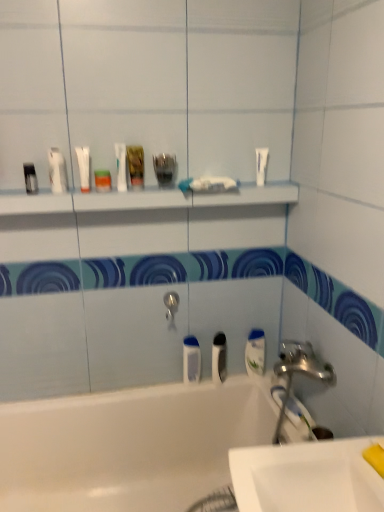
Locate an element on the screen. white glossy mouthwash at right, placed as the fifth mouthwash when sorted from left to right is located at coordinates (255, 352).

Where is `metallic silver container at center, the third toiletry from the left`? metallic silver container at center, the third toiletry from the left is located at coordinates (164, 168).

What do you see at coordinates (298, 415) in the screenshot?
I see `white plastic toothbrush at lower right` at bounding box center [298, 415].

Find the location of a particular element. matte black container at upper left, marked as the first toiletry in a left-to-right arrangement is located at coordinates (30, 178).

Describe the element at coordinates (57, 170) in the screenshot. I see `white matte tube at upper left, the 2th toiletry positioned from the left` at that location.

The height and width of the screenshot is (512, 384). Identify the location of white matte toothpaste at center, the second toothpaste from the right. (213, 184).

Identify the location of white glossy mouthwash at right, the 3th mouthwash from the bottom. [255, 352].

Does translucent plastic mouthwash at center, which is the fifth mouthwash in top-to-bottom order, have a smaller size compared to black plastic toothbrush at center, marked as the second mouthwash in a right-to-left arrangement?

Indeed, translucent plastic mouthwash at center, which is the fifth mouthwash in top-to-bottom order, has a smaller size compared to black plastic toothbrush at center, marked as the second mouthwash in a right-to-left arrangement.

From a real-world perspective, is translucent plastic mouthwash at center, the 3th mouthwash viewed from the right, physically above black plastic toothbrush at center, positioned as the fourth mouthwash in left-to-right order?

Answer: No, from a real-world perspective, translucent plastic mouthwash at center, the 3th mouthwash viewed from the right, is not on top of black plastic toothbrush at center, positioned as the fourth mouthwash in left-to-right order.

Looking at this image, between translucent plastic mouthwash at center, which is the fifth mouthwash in top-to-bottom order, and black plastic toothbrush at center, marked as the second mouthwash in a right-to-left arrangement, which one has smaller width?

translucent plastic mouthwash at center, which is the fifth mouthwash in top-to-bottom order, is thinner.

Locate an element on the screen. mouthwash located below the black plastic toothbrush at center, positioned as the fourth mouthwash in left-to-right order (from the image's perspective) is located at coordinates (191, 360).

Does white glossy tube at upper center, arranged as the 5th mouthwash when viewed from the right, lie in front of white glossy bathtub at lower left?

That is False.

In terms of width, does white glossy tube at upper center, arranged as the first mouthwash when viewed from the left, look wider or thinner when compared to white glossy bathtub at lower left?

white glossy tube at upper center, arranged as the first mouthwash when viewed from the left, is thinner than white glossy bathtub at lower left.

Is white glossy tube at upper center, which is counted as the fourth mouthwash, starting from the bottom, oriented away from white glossy bathtub at lower left?

No, white glossy tube at upper center, which is counted as the fourth mouthwash, starting from the bottom, is not facing the opposite direction of white glossy bathtub at lower left.

Where is `tap that is behind the metallic silver container at center, the third toiletry from the left`? The height and width of the screenshot is (512, 384). tap that is behind the metallic silver container at center, the third toiletry from the left is located at coordinates (171, 304).

From the picture: From a real-world perspective, is metallic silver container at center, the third toiletry from the left, positioned above or below silver metallic tap at center?

metallic silver container at center, the third toiletry from the left, is situated higher than silver metallic tap at center in the real world.

How many degrees apart are the facing directions of metallic silver container at center, the third toiletry from the left, and silver metallic tap at center?

The angular difference between metallic silver container at center, the third toiletry from the left, and silver metallic tap at center is 0.941 degrees.

Is metallic silver container at center, which is counted as the 1th toiletry, starting from the right, turned away from silver metallic tap at center?

metallic silver container at center, which is counted as the 1th toiletry, starting from the right, does not have its back to silver metallic tap at center.

The image size is (384, 512). In order to click on toothpaste that is the 1st object located behind the white glossy sink at lower right in this screenshot , I will do `click(213, 184)`.

From the image's perspective, does white glossy sink at lower right appear lower than white matte toothpaste at center, the second toothpaste from the right?

Yes, from the image's perspective, white glossy sink at lower right is beneath white matte toothpaste at center, the second toothpaste from the right.

Is white glossy sink at lower right oriented away from white matte toothpaste at center, which ranks as the 1th toothpaste in left-to-right order?

No.

Considering the relative sizes of green plastic mouthwash at upper center, which is counted as the first mouthwash, starting from the top, and matte black container at upper left, acting as the 3th toiletry starting from the right, in the image provided, is green plastic mouthwash at upper center, which is counted as the first mouthwash, starting from the top, smaller than matte black container at upper left, acting as the 3th toiletry starting from the right,?

No.

Is green plastic mouthwash at upper center, placed as the 2th mouthwash when sorted from left to right, thinner than matte black container at upper left, acting as the 3th toiletry starting from the right?

No.

Who is more distant, green plastic mouthwash at upper center, which is counted as the first mouthwash, starting from the top, or matte black container at upper left, acting as the 3th toiletry starting from the right?

Positioned behind is green plastic mouthwash at upper center, which is counted as the first mouthwash, starting from the top.

Can you tell me how much white glossy bathtub at lower left and silver metallic tap at center differ in facing direction?

5.15e-05 degrees separate the facing orientations of white glossy bathtub at lower left and silver metallic tap at center.

Would you consider white glossy bathtub at lower left to be distant from silver metallic tap at center?

No, white glossy bathtub at lower left is not far from silver metallic tap at center.

Is silver metallic tap at center surrounded by white glossy bathtub at lower left?

No.

Locate an element on the screen. The height and width of the screenshot is (512, 384). tap above the white glossy bathtub at lower left (from the image's perspective) is located at coordinates (171, 304).

Does metallic silver container at center, which is counted as the 1th toiletry, starting from the right, touch white matte tube at upper left, the second toiletry when ordered from right to left?

No, metallic silver container at center, which is counted as the 1th toiletry, starting from the right, is not touching white matte tube at upper left, the second toiletry when ordered from right to left.

Is metallic silver container at center, which is counted as the 1th toiletry, starting from the right, positioned behind white matte tube at upper left, the 2th toiletry positioned from the left?

Yes, metallic silver container at center, which is counted as the 1th toiletry, starting from the right, is further from the viewer.

Which of these two, metallic silver container at center, the third toiletry from the left, or white matte tube at upper left, the second toiletry when ordered from right to left, is smaller?

white matte tube at upper left, the second toiletry when ordered from right to left, is smaller.

What's the angular difference between metallic silver container at center, the third toiletry from the left, and white matte tube at upper left, the 2th toiletry positioned from the left,'s facing directions?

There is a 2.34-degree angle between the facing directions of metallic silver container at center, the third toiletry from the left, and white matte tube at upper left, the 2th toiletry positioned from the left.

You are a GUI agent. You are given a task and a screenshot of the screen. Output one action in this format:
    pyautogui.click(x=<x>, y=<y>)
    Task: Click on the mouthwash that is the 1st one when counting rightward from the translucent plastic mouthwash at center, which ranks as the 3th mouthwash in left-to-right order
    Image resolution: width=384 pixels, height=512 pixels.
    Given the screenshot: What is the action you would take?
    (219, 358)

Find the location of `bathtub below the white glossy tube at upper center, arranged as the first mouthwash when viewed from the left (from a real-world perspective)`. bathtub below the white glossy tube at upper center, arranged as the first mouthwash when viewed from the left (from a real-world perspective) is located at coordinates (130, 446).

Estimate the real-world distances between objects in this image. Which object is closer to white glossy mouthwash at right, placed as the fifth mouthwash when sorted from left to right, white glossy shelf at upper center or silver metallic tap at center?

silver metallic tap at center.

Which object lies further to the anchor point matte black container at upper left, acting as the 3th toiletry starting from the right, white matte toothpaste at center, the second toothpaste from the right, or white matte tube at upper right, which is the second toothpaste from left to right?

Among the two, white matte tube at upper right, which is the second toothpaste from left to right, is located further to matte black container at upper left, acting as the 3th toiletry starting from the right.

Which object lies further to the anchor point white glossy bathtub at lower left, green plastic mouthwash at upper center, the 4th mouthwash viewed from the right, or black plastic toothbrush at center, marked as the second mouthwash in a right-to-left arrangement?

Among the two, green plastic mouthwash at upper center, the 4th mouthwash viewed from the right, is located further to white glossy bathtub at lower left.

From the image, which object appears to be nearer to white matte tube at upper left, the 2th toiletry positioned from the left, white matte tube at upper right, which is the second toothpaste from left to right, or metallic silver container at center, which is counted as the 1th toiletry, starting from the right?

metallic silver container at center, which is counted as the 1th toiletry, starting from the right, lies closer to white matte tube at upper left, the 2th toiletry positioned from the left, than the other object.

When comparing their distances from silver metallic tap at center, does black plastic toothbrush at center, marked as the second mouthwash in a right-to-left arrangement, or white glossy sink at lower right seem further?

white glossy sink at lower right lies further to silver metallic tap at center than the other object.

Which object lies further to the anchor point translucent plastic mouthwash at center, which is the fifth mouthwash in top-to-bottom order, white matte toothpaste at center, which ranks as the 1th toothpaste in left-to-right order, or black plastic toothbrush at center, which is the second mouthwash from bottom to top?

Based on the image, white matte toothpaste at center, which ranks as the 1th toothpaste in left-to-right order, appears to be further to translucent plastic mouthwash at center, which is the fifth mouthwash in top-to-bottom order.

Based on the photo, estimate the real-world distances between objects in this image. Which object is further from translucent plastic mouthwash at center, which appears as the 1th mouthwash when ordered from the bottom, white glossy bathtub at lower left or white plastic toothbrush at lower right?

Among the two, white glossy bathtub at lower left is located further to translucent plastic mouthwash at center, which appears as the 1th mouthwash when ordered from the bottom.

Looking at this image, considering their positions, is black plastic toothbrush at center, which is the second mouthwash from bottom to top, positioned closer to white glossy tube at upper center, arranged as the first mouthwash when viewed from the left, than white glossy mouthwash at right, which is the 3th mouthwash in top-to-bottom order?

black plastic toothbrush at center, which is the second mouthwash from bottom to top, is positioned closer to the anchor white glossy tube at upper center, arranged as the first mouthwash when viewed from the left.

Locate an element on the screen. The image size is (384, 512). toothbrush between metallic silver container at center, the third toiletry from the left, and white glossy bathtub at lower left in the up-down direction is located at coordinates (298, 415).

Identify the location of toiletry between matte black container at upper left, marked as the first toiletry in a left-to-right arrangement, and white glossy shelf at upper center. The image size is (384, 512). (57, 170).

You are a GUI agent. You are given a task and a screenshot of the screen. Output one action in this format:
    pyautogui.click(x=<x>, y=<y>)
    Task: Click on the mouthwash between green plastic mouthwash at upper center, placed as the 2th mouthwash when sorted from left to right, and white glossy mouthwash at right, which ranks as the 1th mouthwash in right-to-left order, in the up-down direction
    This screenshot has height=512, width=384.
    Given the screenshot: What is the action you would take?
    (84, 167)

Where is `toothpaste between green plastic mouthwash at upper center, placed as the 2th mouthwash when sorted from left to right, and black plastic toothbrush at center, marked as the second mouthwash in a right-to-left arrangement, in the up-down direction`? toothpaste between green plastic mouthwash at upper center, placed as the 2th mouthwash when sorted from left to right, and black plastic toothbrush at center, marked as the second mouthwash in a right-to-left arrangement, in the up-down direction is located at coordinates (213, 184).